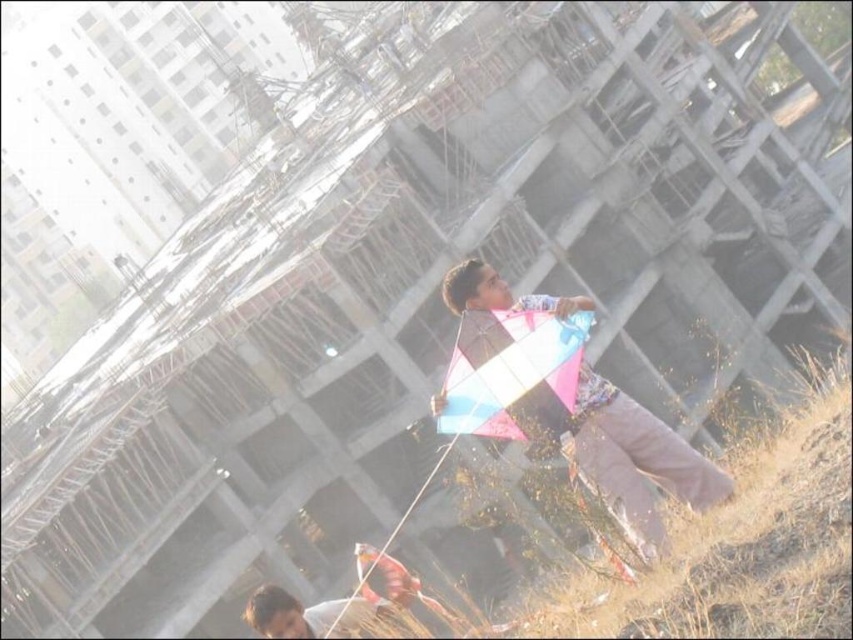
Does matte pink kite at center appear under translucent plastic kite at center?

Yes.

Is point (650, 540) positioned before point (447, 397)?

Yes, point (650, 540) is in front of point (447, 397).

This screenshot has height=640, width=853. I want to click on matte pink kite at center, so click(x=625, y=454).